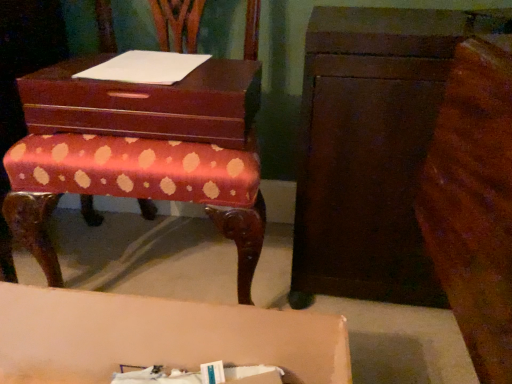
Question: From a real-world perspective, does matte pink table at lower center stand above mahogany wood storage box at center?

Choices:
 (A) yes
 (B) no

Answer: (B)

Question: Can you confirm if matte pink table at lower center is positioned to the left of mahogany wood storage box at center?

Choices:
 (A) yes
 (B) no

Answer: (B)

Question: Considering the relative sizes of matte pink table at lower center and mahogany wood storage box at center in the image provided, is matte pink table at lower center bigger than mahogany wood storage box at center?

Choices:
 (A) no
 (B) yes

Answer: (B)

Question: Is matte pink table at lower center looking in the opposite direction of mahogany wood storage box at center?

Choices:
 (A) no
 (B) yes

Answer: (A)

Question: Considering the relative sizes of matte pink table at lower center and mahogany wood storage box at center in the image provided, is matte pink table at lower center shorter than mahogany wood storage box at center?

Choices:
 (A) yes
 (B) no

Answer: (B)

Question: In terms of height, does polished wood bench at center look taller or shorter compared to dark brown wood chest of drawers at right?

Choices:
 (A) tall
 (B) short

Answer: (A)

Question: From the image's perspective, is polished wood bench at center above or below dark brown wood chest of drawers at right?

Choices:
 (A) below
 (B) above

Answer: (B)

Question: Considering the positions of polished wood bench at center and dark brown wood chest of drawers at right in the image, is polished wood bench at center wider or thinner than dark brown wood chest of drawers at right?

Choices:
 (A) wide
 (B) thin

Answer: (A)

Question: Is polished wood bench at center bigger or smaller than dark brown wood chest of drawers at right?

Choices:
 (A) big
 (B) small

Answer: (A)

Question: From a real-world perspective, is white paper at upper center positioned above or below polished wood bench at center?

Choices:
 (A) below
 (B) above

Answer: (B)

Question: In terms of height, does white paper at upper center look taller or shorter compared to polished wood bench at center?

Choices:
 (A) tall
 (B) short

Answer: (B)

Question: Is white paper at upper center spatially inside polished wood bench at center, or outside of it?

Choices:
 (A) inside
 (B) outside

Answer: (A)

Question: From the image's perspective, is white paper at upper center positioned above or below polished wood bench at center?

Choices:
 (A) below
 (B) above

Answer: (B)

Question: Do you think polished wood bench at center is within matte pink table at lower center, or outside of it?

Choices:
 (A) inside
 (B) outside

Answer: (B)

Question: From a real-world perspective, is polished wood bench at center above or below matte pink table at lower center?

Choices:
 (A) above
 (B) below

Answer: (A)